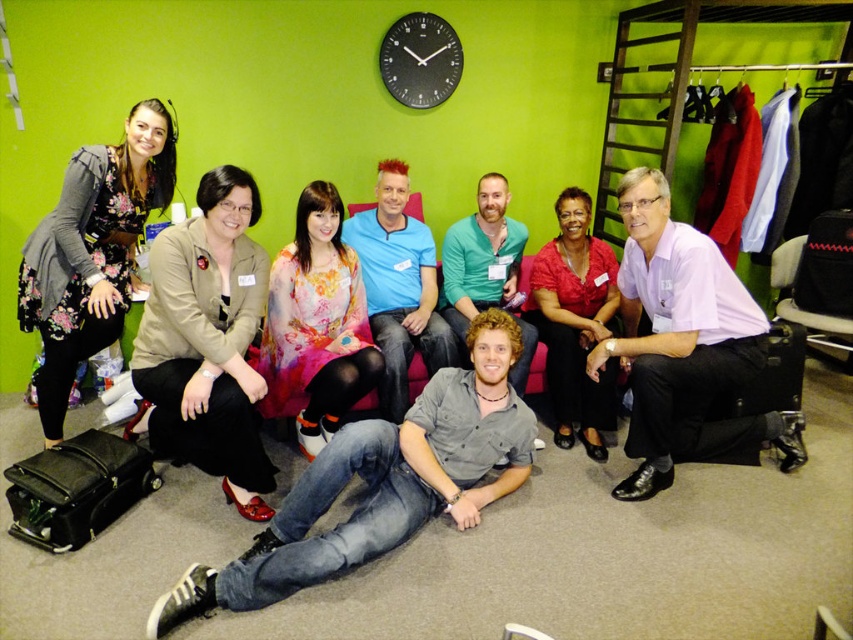
Does jeans at center appear on the right side of black matte clock at upper center?

Incorrect, jeans at center is not on the right side of black matte clock at upper center.

Between jeans at center and black matte clock at upper center, which one appears on the right side from the viewer's perspective?

black matte clock at upper center is more to the right.

Identify the location of jeans at center. (381, 483).

Locate an element on the screen. This screenshot has height=640, width=853. jeans at center is located at coordinates (381, 483).

Is jeans at center wider than floral dress at left?

Indeed, jeans at center has a greater width compared to floral dress at left.

Identify the location of jeans at center. This screenshot has width=853, height=640. pos(381,483).

Identify the location of jeans at center. (381, 483).

Can you confirm if floral dress at left is positioned below teal matte shirt at center?

Correct, floral dress at left is located below teal matte shirt at center.

Is floral dress at left behind teal matte shirt at center?

No, floral dress at left is closer to the viewer.

Between point (132, 163) and point (505, 188), which one is positioned behind?

Point (505, 188)

This screenshot has width=853, height=640. I want to click on floral dress at left, so click(91, 252).